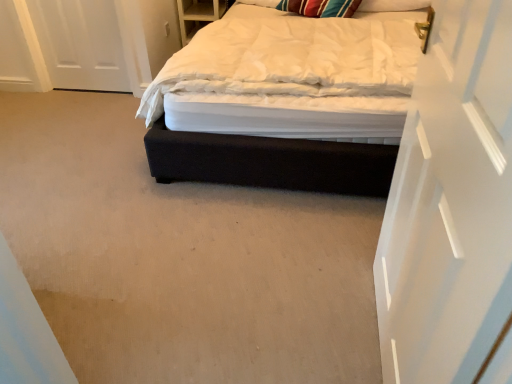
Question: Is striped fabric pillow at upper right not within dark fabric bed at center?

Choices:
 (A) no
 (B) yes

Answer: (A)

Question: Would you say striped fabric pillow at upper right is a long distance from dark fabric bed at center?

Choices:
 (A) yes
 (B) no

Answer: (A)

Question: Is striped fabric pillow at upper right touching dark fabric bed at center?

Choices:
 (A) no
 (B) yes

Answer: (A)

Question: Does striped fabric pillow at upper right have a greater width compared to dark fabric bed at center?

Choices:
 (A) yes
 (B) no

Answer: (B)

Question: Considering the relative positions of striped fabric pillow at upper right and dark fabric bed at center in the image provided, is striped fabric pillow at upper right to the right of dark fabric bed at center from the viewer's perspective?

Choices:
 (A) yes
 (B) no

Answer: (A)

Question: Does striped fabric pillow at upper right appear on the left side of dark fabric bed at center?

Choices:
 (A) no
 (B) yes

Answer: (A)

Question: Is the depth of white glossy door at upper right less than that of striped fabric pillow at upper right?

Choices:
 (A) yes
 (B) no

Answer: (A)

Question: Are white glossy door at upper right and striped fabric pillow at upper right beside each other?

Choices:
 (A) no
 (B) yes

Answer: (A)

Question: Does white glossy door at upper right have a lesser height compared to striped fabric pillow at upper right?

Choices:
 (A) no
 (B) yes

Answer: (A)

Question: Is white glossy door at upper right positioned with its back to striped fabric pillow at upper right?

Choices:
 (A) yes
 (B) no

Answer: (B)

Question: Does white glossy door at upper right appear on the left side of striped fabric pillow at upper right?

Choices:
 (A) yes
 (B) no

Answer: (A)

Question: Considering the relative sizes of white glossy door at upper right and striped fabric pillow at upper right in the image provided, is white glossy door at upper right thinner than striped fabric pillow at upper right?

Choices:
 (A) yes
 (B) no

Answer: (A)

Question: Does dark fabric bed at center come behind striped fabric pillow at upper right?

Choices:
 (A) yes
 (B) no

Answer: (B)